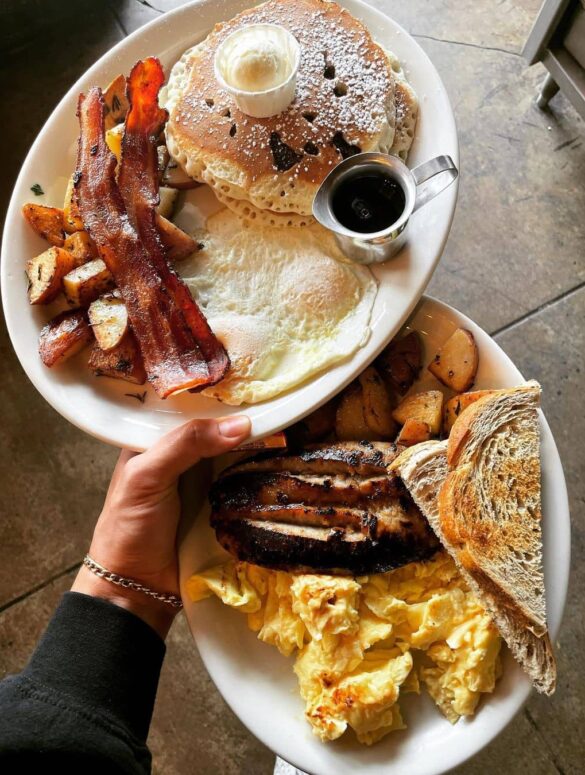
The image size is (585, 775). Find the location of `plate`. plate is located at coordinates (452, 751), (256, 421).